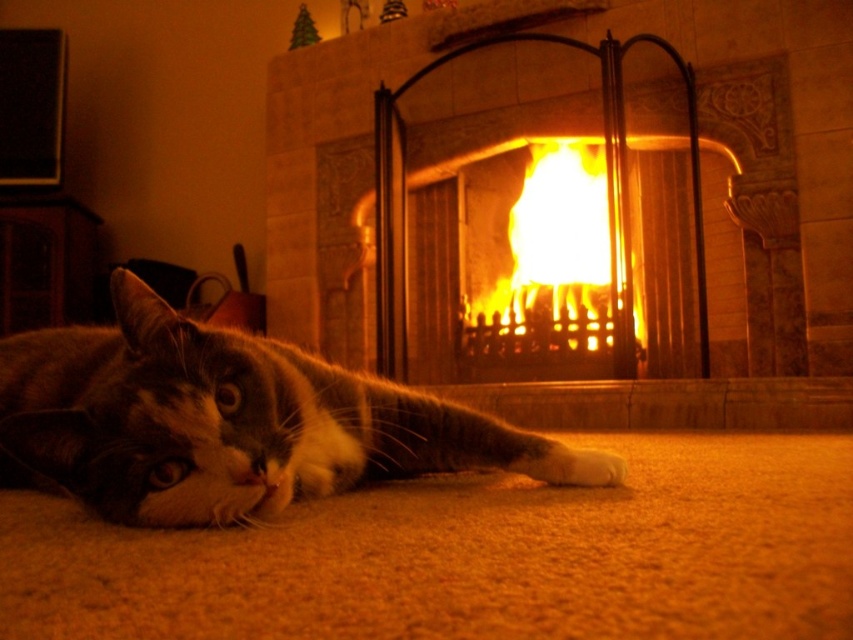
You are standing in the room and want to approach the tabby fur cat at lower left. Based on its position, which direction should you move from the fireplace to reach the cat?

The tabby fur cat at lower left is located at point 0.659 on the x and 0.270 on the y, so you should move towards the lower left direction from the fireplace to reach the cat.

You are a guest in the living room and want to see both the tabby fur cat at lower left and the matte stone fireplace at center. Which object is closer to your eye level?

The matte stone fireplace at center is taller than the tabby fur cat at lower left, so the fireplace is closer to your eye level.